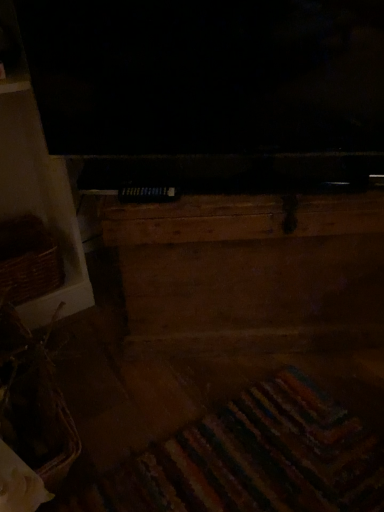
Question: Considering the positions of woven brown basket at lower left, which is the second basket from top to bottom, and wooden chest at center in the image, is woven brown basket at lower left, which is the second basket from top to bottom, wider or thinner than wooden chest at center?

Choices:
 (A) wide
 (B) thin

Answer: (B)

Question: From a real-world perspective, is woven brown basket at lower left, arranged as the 1th basket when ordered from the bottom, physically located above or below wooden chest at center?

Choices:
 (A) above
 (B) below

Answer: (B)

Question: Based on their relative distances, which object is nearer to the woven brown basket at lower left, which appears as the 1th basket when viewed from the front?

Choices:
 (A) brown woven basket at left, which appears as the 1th basket when viewed from the back
 (B) wooden chest at center

Answer: (A)

Question: Which object is positioned farthest from the woven brown basket at lower left, which is the second basket from top to bottom?

Choices:
 (A) brown woven basket at left, which appears as the 1th basket when viewed from the back
 (B) wooden chest at center

Answer: (B)